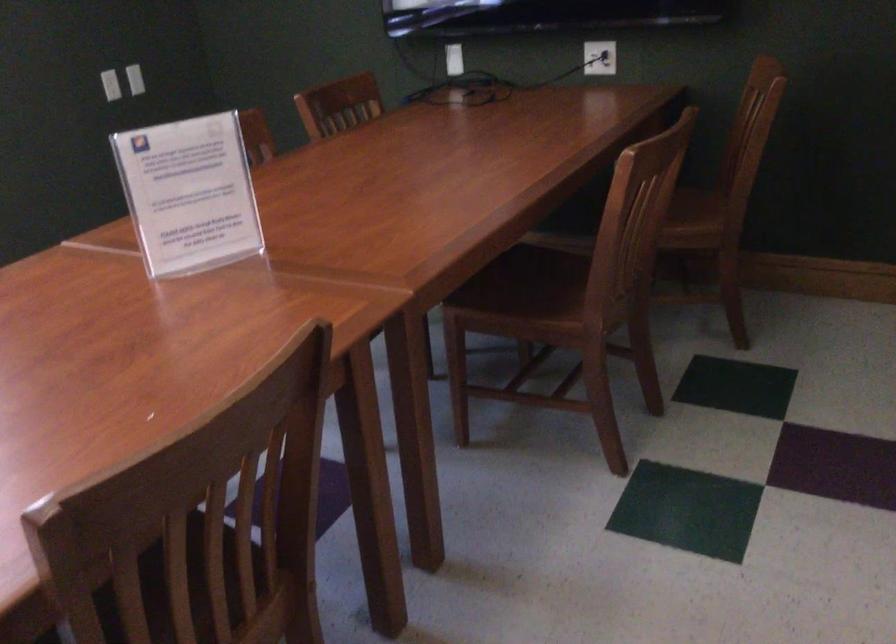
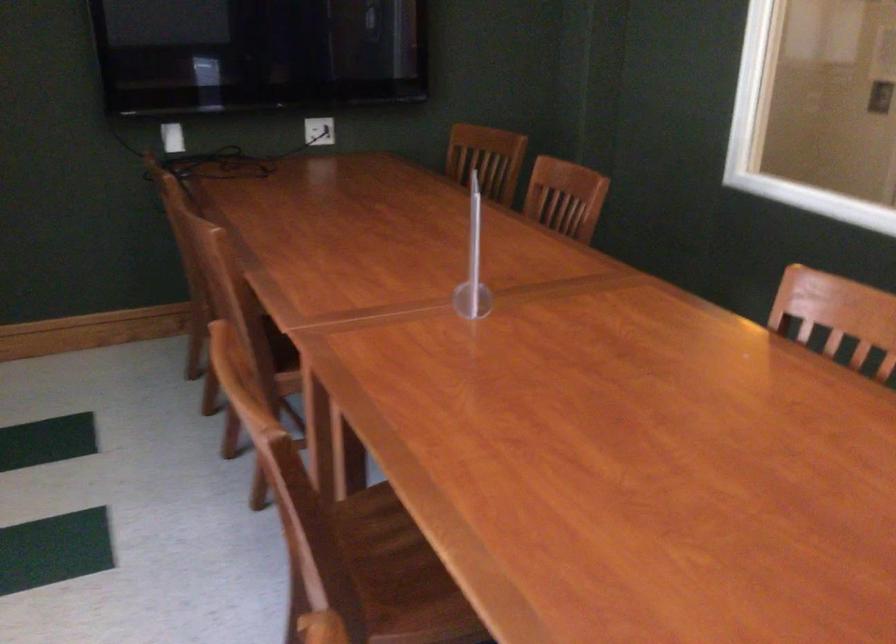
Locate, in the second image, the point that corresponds to pixel 752 115 in the first image.

(487, 158)